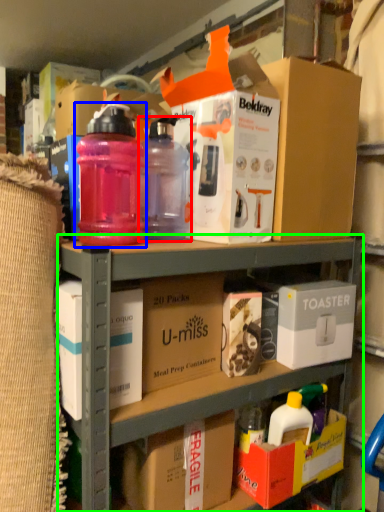
Question: Estimate the real-world distances between objects in this image. Which object is farther from bottle (highlighted by a red box), bottle (highlighted by a blue box) or shelf (highlighted by a green box)?

Choices:
 (A) bottle
 (B) shelf

Answer: (B)